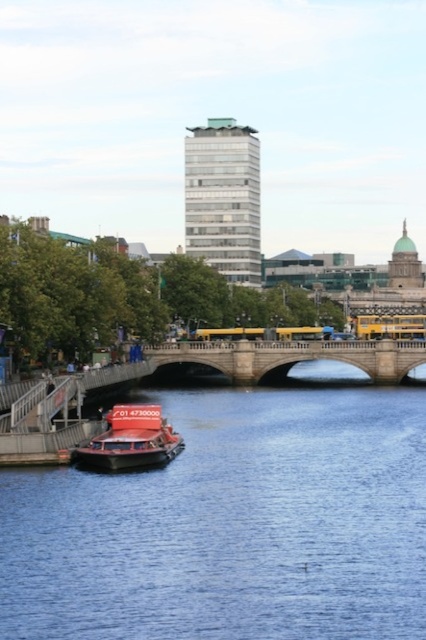
You are a tourist standing on the stone bridge at center and want to take a photo of the shiny red boat at lower left. Considering the size difference between them, which object should you focus on to ensure both are clearly visible in your photo?

Since the stone bridge at center is larger in size than the shiny red boat at lower left, you should focus on the stone bridge at center to ensure both objects are clearly visible in the photo.

In the scene shown: You are standing at the point labeled point (325, 609) and want to walk to the point labeled point (396, 314). Which direction should you face to walk directly towards your destination?

You should face north to walk directly towards point (396, 314) from point (325, 609).